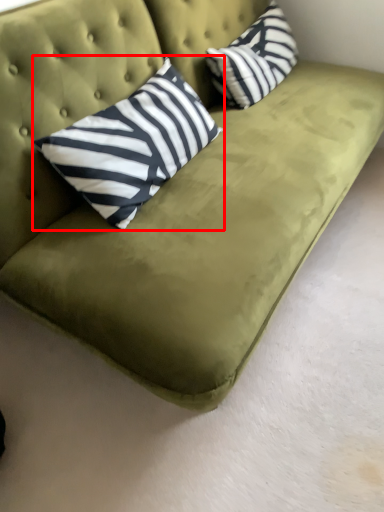
Question: From the image's perspective, what is the correct spatial relationship of pillow (annotated by the red box) in relation to pillow?

Choices:
 (A) below
 (B) above

Answer: (A)